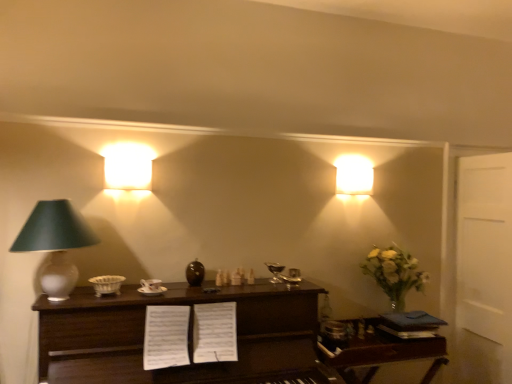
Question: From a real-world perspective, relative to matte white lampshade at upper left, marked as the second lamp in a front-to-back arrangement, is matte white lamp at left, the 3th lamp in the right-to-left sequence, vertically above or below?

Choices:
 (A) below
 (B) above

Answer: (A)

Question: From the image's perspective, is matte white lamp at left, which is the 1th lamp from front to back, above or below matte white lampshade at upper left, the second lamp from the back?

Choices:
 (A) above
 (B) below

Answer: (B)

Question: Which object is positioned closest to the matte white lamp at left, which is the 1th lamp from front to back?

Choices:
 (A) matte white square light at upper right, placed as the 3th lamp when sorted from left to right
 (B) dark wood table at center, positioned as the second table in right-to-left order
 (C) matte white lampshade at upper left, marked as the second lamp in a front-to-back arrangement
 (D) wooden table at right, which is the 1th table in right-to-left order

Answer: (C)

Question: Based on their relative distances, which object is farther from the matte white lamp at left, which ranks as the 1th lamp in left-to-right order?

Choices:
 (A) wooden table at right, which is the 1th table in right-to-left order
 (B) matte white lampshade at upper left, which ranks as the 2th lamp in right-to-left order
 (C) matte white square light at upper right, the 3th lamp positioned from the front
 (D) dark wood table at center, positioned as the second table in right-to-left order

Answer: (C)